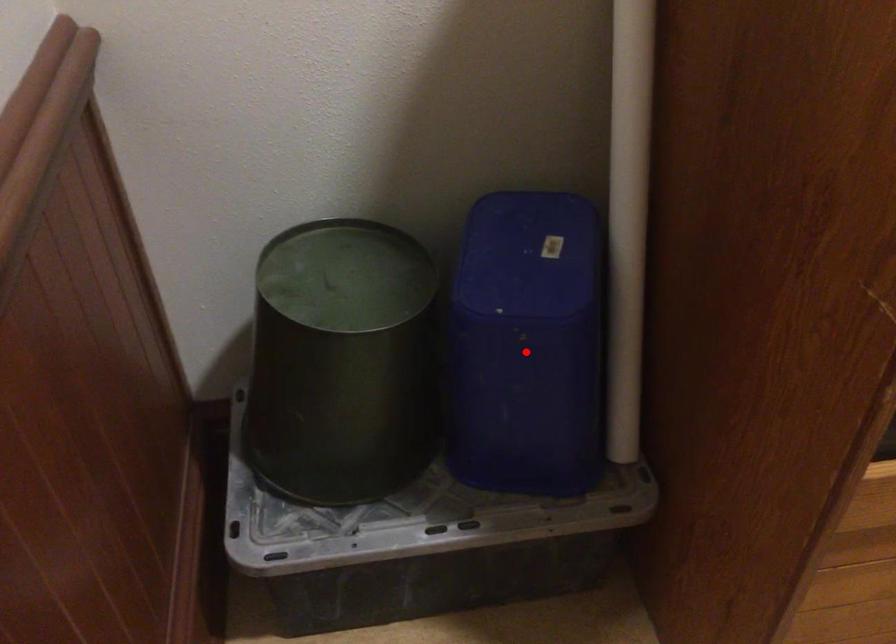
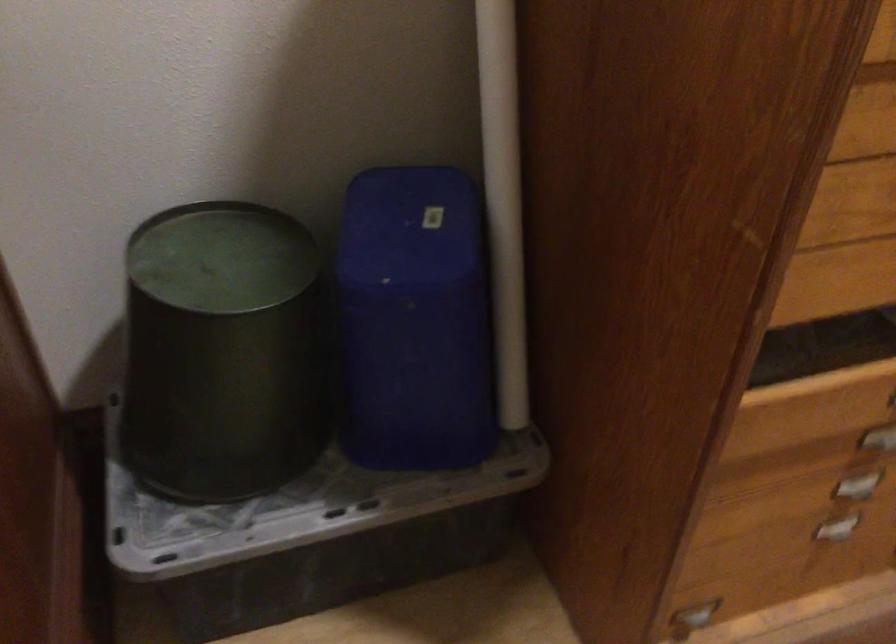
Find the pixel in the second image that matches the highlighted location in the first image.

(414, 321)